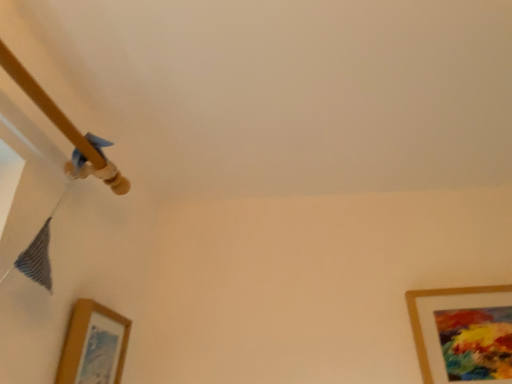
Question: Can you confirm if wooden picture frame at lower left, arranged as the second picture frame when viewed from the right, is bigger than gold matte picture frame at lower right, which appears as the first picture frame when viewed from the right?

Choices:
 (A) no
 (B) yes

Answer: (A)

Question: Is wooden picture frame at lower left, arranged as the second picture frame when viewed from the right, positioned with its back to gold matte picture frame at lower right, which appears as the first picture frame when viewed from the right?

Choices:
 (A) no
 (B) yes

Answer: (A)

Question: Is there a large distance between wooden picture frame at lower left, arranged as the second picture frame when viewed from the right, and gold matte picture frame at lower right, which appears as the 2th picture frame when viewed from the left?

Choices:
 (A) yes
 (B) no

Answer: (B)

Question: Considering the relative positions of wooden picture frame at lower left, arranged as the second picture frame when viewed from the right, and gold matte picture frame at lower right, which appears as the 2th picture frame when viewed from the left, in the image provided, is wooden picture frame at lower left, arranged as the second picture frame when viewed from the right, to the left of gold matte picture frame at lower right, which appears as the 2th picture frame when viewed from the left, from the viewer's perspective?

Choices:
 (A) yes
 (B) no

Answer: (A)

Question: From a real-world perspective, does wooden picture frame at lower left, arranged as the second picture frame when viewed from the right, stand above gold matte picture frame at lower right, which appears as the 2th picture frame when viewed from the left?

Choices:
 (A) yes
 (B) no

Answer: (B)

Question: Is wooden picture frame at lower left, the 1th picture frame in the left-to-right sequence, surrounding gold matte picture frame at lower right, which appears as the 2th picture frame when viewed from the left?

Choices:
 (A) yes
 (B) no

Answer: (B)

Question: Does gold matte picture frame at lower right, which appears as the first picture frame when viewed from the right, come in front of wooden picture frame at lower left, arranged as the second picture frame when viewed from the right?

Choices:
 (A) no
 (B) yes

Answer: (A)

Question: Is gold matte picture frame at lower right, which appears as the first picture frame when viewed from the right, looking in the opposite direction of wooden picture frame at lower left, arranged as the second picture frame when viewed from the right?

Choices:
 (A) no
 (B) yes

Answer: (A)

Question: From the image's perspective, does gold matte picture frame at lower right, which appears as the first picture frame when viewed from the right, appear lower than wooden picture frame at lower left, the 1th picture frame in the left-to-right sequence?

Choices:
 (A) yes
 (B) no

Answer: (A)

Question: Is gold matte picture frame at lower right, which appears as the first picture frame when viewed from the right, next to wooden picture frame at lower left, the 1th picture frame in the left-to-right sequence, and touching it?

Choices:
 (A) yes
 (B) no

Answer: (B)

Question: Considering the relative positions of gold matte picture frame at lower right, which appears as the first picture frame when viewed from the right, and wooden picture frame at lower left, arranged as the second picture frame when viewed from the right, in the image provided, is gold matte picture frame at lower right, which appears as the first picture frame when viewed from the right, to the left of wooden picture frame at lower left, arranged as the second picture frame when viewed from the right, from the viewer's perspective?

Choices:
 (A) yes
 (B) no

Answer: (B)

Question: From a real-world perspective, is gold matte picture frame at lower right, which appears as the 2th picture frame when viewed from the left, below wooden picture frame at lower left, arranged as the second picture frame when viewed from the right?

Choices:
 (A) yes
 (B) no

Answer: (B)

Question: In the image, is gold matte picture frame at lower right, which appears as the first picture frame when viewed from the right, on the left side or the right side of wooden picture frame at lower left, the 1th picture frame in the left-to-right sequence?

Choices:
 (A) left
 (B) right

Answer: (B)